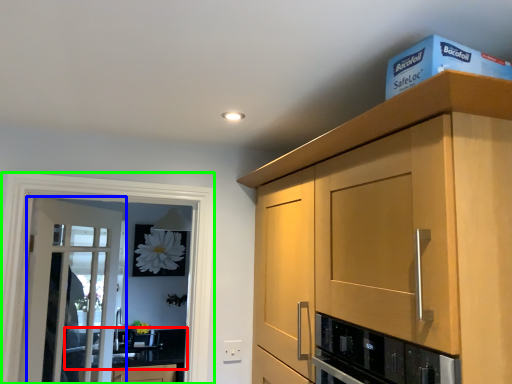
Question: Based on their relative distances, which object is nearer to countertop (highlighted by a red box)? Choose from door (highlighted by a blue box) and screen door (highlighted by a green box).

Choices:
 (A) door
 (B) screen door

Answer: (A)